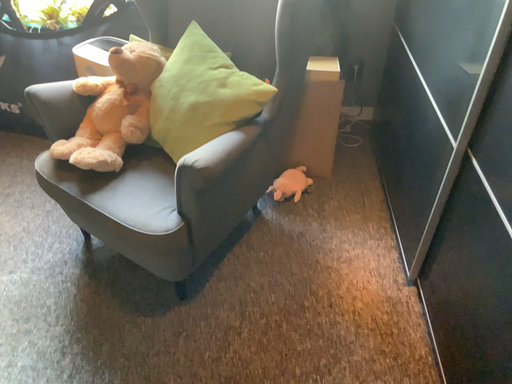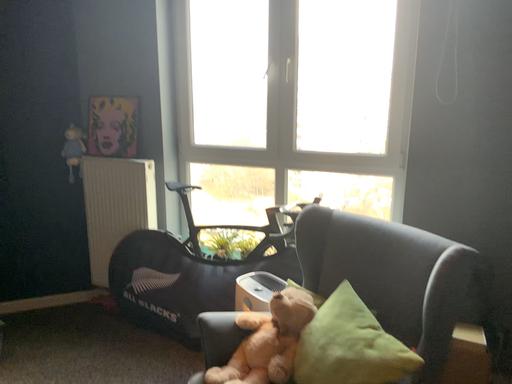
Question: Which way did the camera rotate in the video?

Choices:
 (A) rotated downward
 (B) rotated upward

Answer: (B)